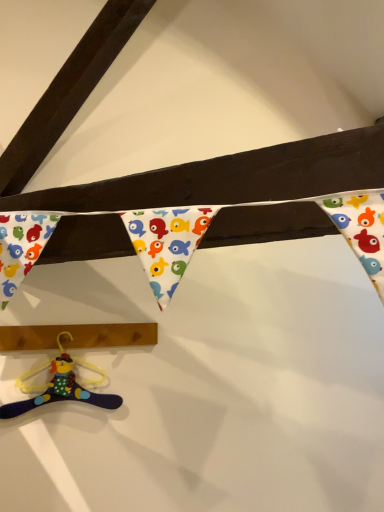
Question: Considering the positions of velvety purple hanger at lower left and wooden plank at lower left in the image, is velvety purple hanger at lower left bigger or smaller than wooden plank at lower left?

Choices:
 (A) small
 (B) big

Answer: (A)

Question: From the image's perspective, is velvety purple hanger at lower left located above or below wooden plank at lower left?

Choices:
 (A) below
 (B) above

Answer: (A)

Question: Is velvety purple hanger at lower left wider or thinner than wooden plank at lower left?

Choices:
 (A) thin
 (B) wide

Answer: (A)

Question: Relative to velvety purple hanger at lower left, is wooden plank at lower left in front or behind?

Choices:
 (A) behind
 (B) front

Answer: (A)

Question: Looking at their shapes, would you say wooden plank at lower left is wider or thinner than velvety purple hanger at lower left?

Choices:
 (A) wide
 (B) thin

Answer: (A)

Question: Based on their sizes in the image, would you say wooden plank at lower left is bigger or smaller than velvety purple hanger at lower left?

Choices:
 (A) big
 (B) small

Answer: (A)

Question: From a real-world perspective, is wooden plank at lower left above or below velvety purple hanger at lower left?

Choices:
 (A) above
 (B) below

Answer: (A)